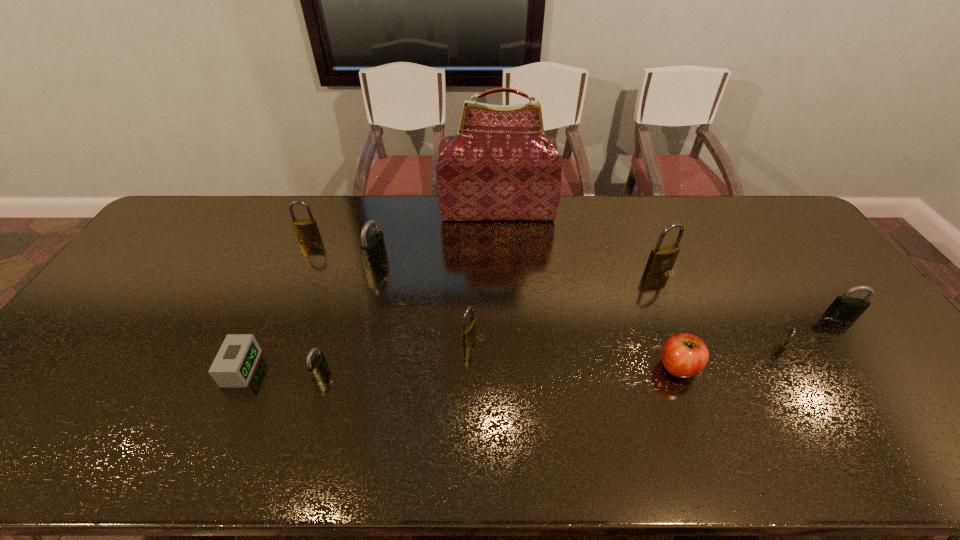
What are the coordinates of `the second brass padlock from left to right` in the screenshot? It's located at (468, 331).

I want to click on the third biggest brass padlock, so click(x=468, y=331).

Find the location of a particular element. This screenshot has height=540, width=960. apple is located at coordinates (684, 355).

Where is `the smallest black padlock`? the smallest black padlock is located at coordinates (317, 367).

Locate an element on the screen. the nearest padlock is located at coordinates 317,367.

Locate an element on the screen. the sixth padlock from left to right is located at coordinates (783, 344).

Where is `the smallest brass padlock`? This screenshot has width=960, height=540. the smallest brass padlock is located at coordinates (783, 344).

Identify the location of the shortest object. (233, 366).

Where is `free point located on the front-facing side of the farthest object`? The height and width of the screenshot is (540, 960). free point located on the front-facing side of the farthest object is located at coordinates (499, 254).

I want to click on vacant point located on the left of the fifth padlock from left to right, so click(x=532, y=269).